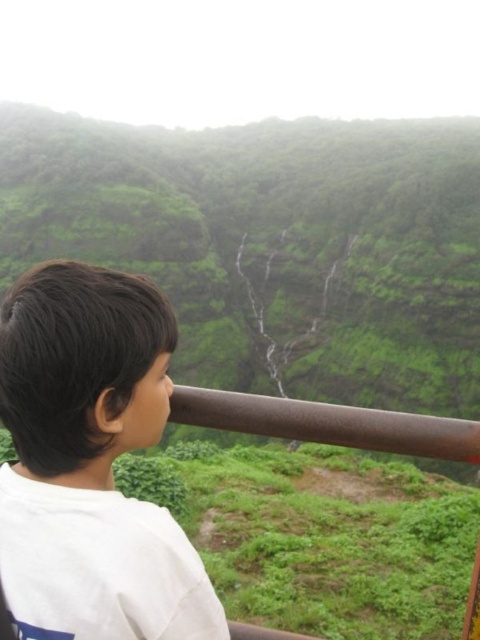
Question: Does green matte mountain at upper center appear on the right side of white matte shirt at left?

Choices:
 (A) yes
 (B) no

Answer: (A)

Question: Among these objects, which one is farthest from the camera?

Choices:
 (A) white matte shirt at left
 (B) green matte mountain at upper center

Answer: (B)

Question: Is green matte mountain at upper center below white matte shirt at left?

Choices:
 (A) no
 (B) yes

Answer: (A)

Question: Considering the relative positions of green matte mountain at upper center and white matte shirt at left in the image provided, where is green matte mountain at upper center located with respect to white matte shirt at left?

Choices:
 (A) below
 (B) above

Answer: (B)

Question: Which object is closer to the camera taking this photo?

Choices:
 (A) white matte shirt at left
 (B) green matte mountain at upper center

Answer: (A)